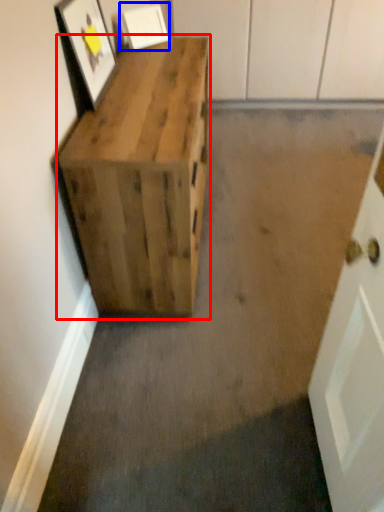
Question: Which object is closer to the camera taking this photo, furniture (highlighted by a red box) or picture frame (highlighted by a blue box)?

Choices:
 (A) furniture
 (B) picture frame

Answer: (A)